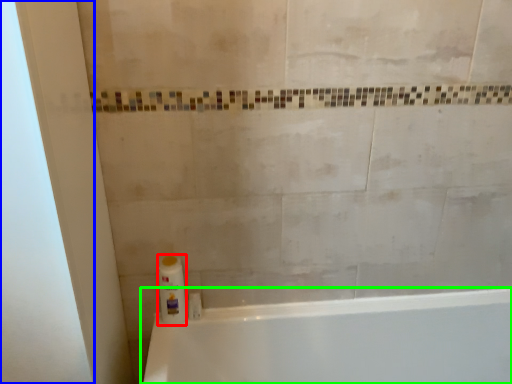
Question: Which is nearer to the cleaning product (highlighted by a red box)? screen door (highlighted by a blue box) or bathtub (highlighted by a green box).

Choices:
 (A) screen door
 (B) bathtub

Answer: (A)